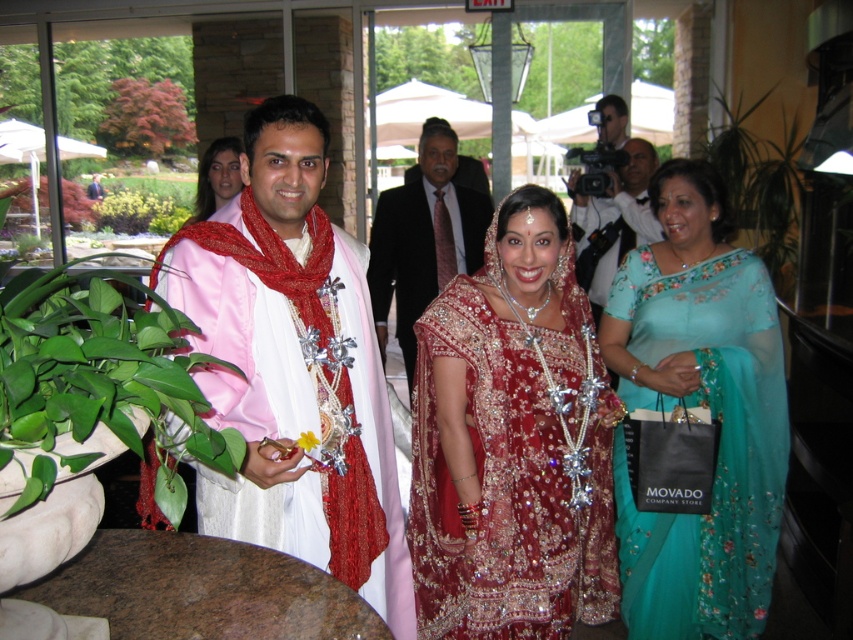
You are a photographer at the wedding reception and need to capture a photo of the matte pink and white dress at center and the matte pink fabric at center. Which one should you focus on if you want to highlight the larger object?

The matte pink and white dress at center has a larger size compared to the matte pink fabric at center, so you should focus on the matte pink and white dress at center to highlight the larger object.

In the scene shown: You are a photographer at the wedding reception and want to position a decorative item exactly at the center of the image. However, you notice the matte pink fabric at center is already placed at coordinates 0.573 on the x and 0.346 on the y. Is the fabric positioned at the true center of the image?

The true center of the image is at coordinates (x=426, y=320). The matte pink fabric at center is located at (x=294, y=365), which is slightly to the right and below the true center. Therefore, it is not positioned exactly at the true center of the image.

You are a photographer at the wedding reception. You want to take a photo focusing on both the matte pink fabric at center and the dark suit at center. Which one will appear larger in the photo?

The matte pink fabric at center will appear larger in the photo because it is closer to the viewer than the dark suit at center.